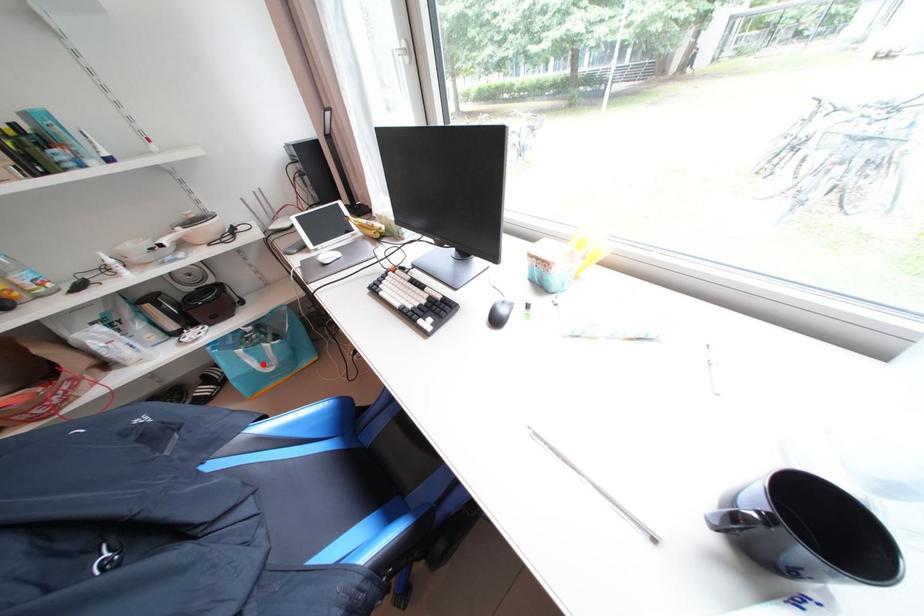
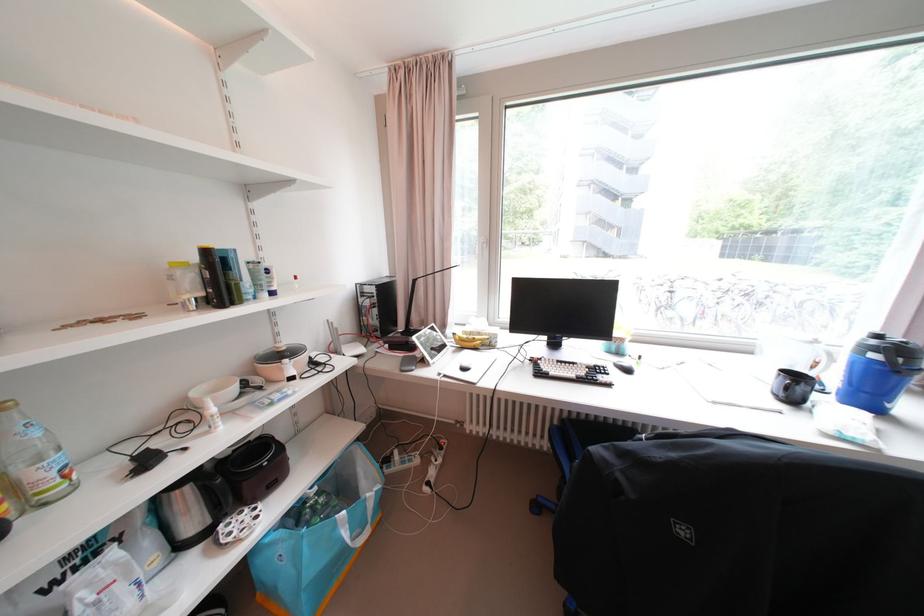
Find the pixel in the second image that matches the highlighted location in the first image.

(354, 537)